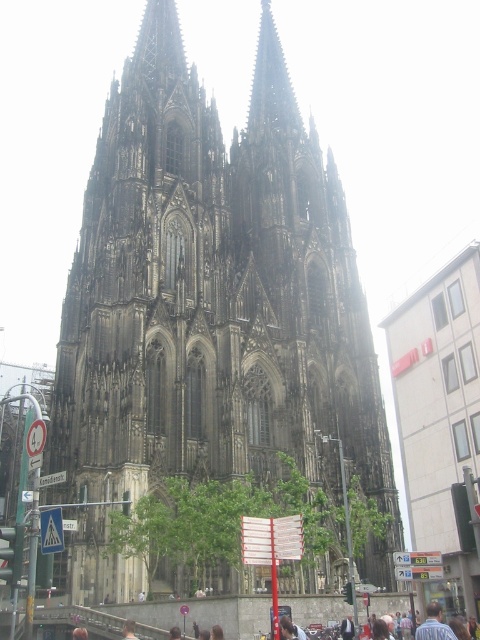
Question: Is dark stone tower at center positioned in front of blonde hair at center?

Choices:
 (A) yes
 (B) no

Answer: (B)

Question: Which of the following is the closest to the observer?

Choices:
 (A) blonde hair at center
 (B) dark brown hair at center
 (C) blue shirt at center
 (D) brown hair at lower center

Answer: (C)

Question: Can you confirm if dark stone tower at center is positioned to the right of dark hair at lower center?

Choices:
 (A) yes
 (B) no

Answer: (B)

Question: Can you confirm if blue shirt at center is bigger than dark hair at lower center?

Choices:
 (A) no
 (B) yes

Answer: (B)

Question: Estimate the real-world distances between objects in this image. Which object is farther from the dark hair at lower center?

Choices:
 (A) brown hair at lower center
 (B) dark brown hair at center

Answer: (A)

Question: Which point appears closest to the camera in this image?

Choices:
 (A) (436, 627)
 (B) (285, 625)
 (C) (172, 637)
 (D) (311, 435)

Answer: (A)